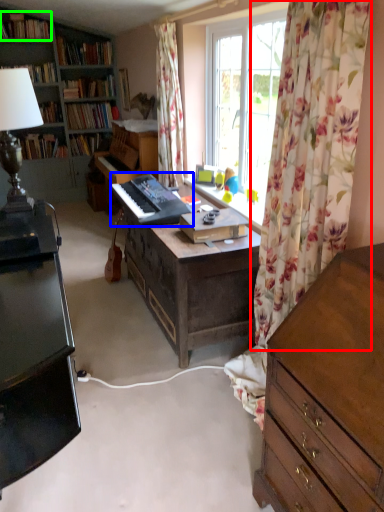
Question: Estimate the real-world distances between objects in this image. Which object is farther from curtain (highlighted by a red box), musical keyboard (highlighted by a blue box) or book (highlighted by a green box)?

Choices:
 (A) musical keyboard
 (B) book

Answer: (B)